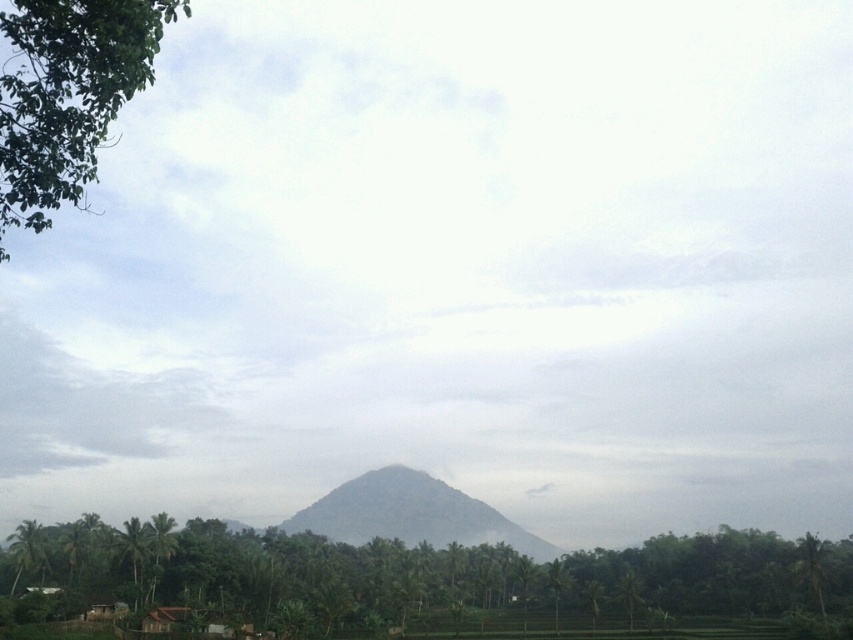
You are an airplane passenger looking out the window and see the green leafy tree at upper left and the green textured mountain at center. Which object would appear larger to you?

The green leafy tree at upper left appears larger because it is closer to the viewer than the green textured mountain at center.

You are standing at the point marked by point (431, 580) in the image, which is surrounded by green leafy trees at center. What can you see immediately around you?

You can see green leafy trees at center around you as you are standing at point (431, 580).

You are standing in the rural landscape and want to walk from the point at coordinates point (45, 148) to the point at coordinates point (409, 541). Which direction should you face to walk towards the second point?

You should face towards the point at coordinates point (409, 541), as it is behind point (45, 148).